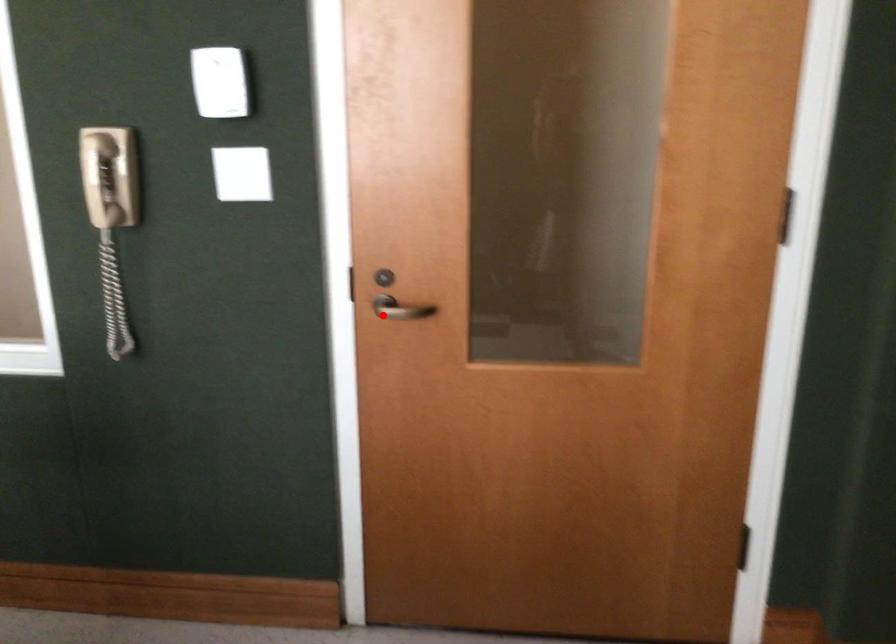
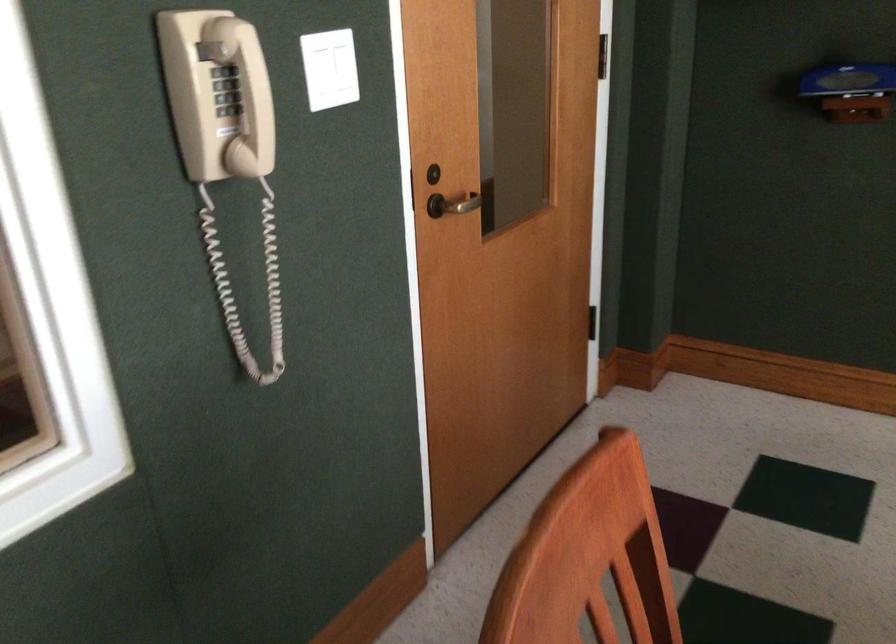
Where in the second image is the point corresponding to the highlighted location from the first image?

(458, 204)